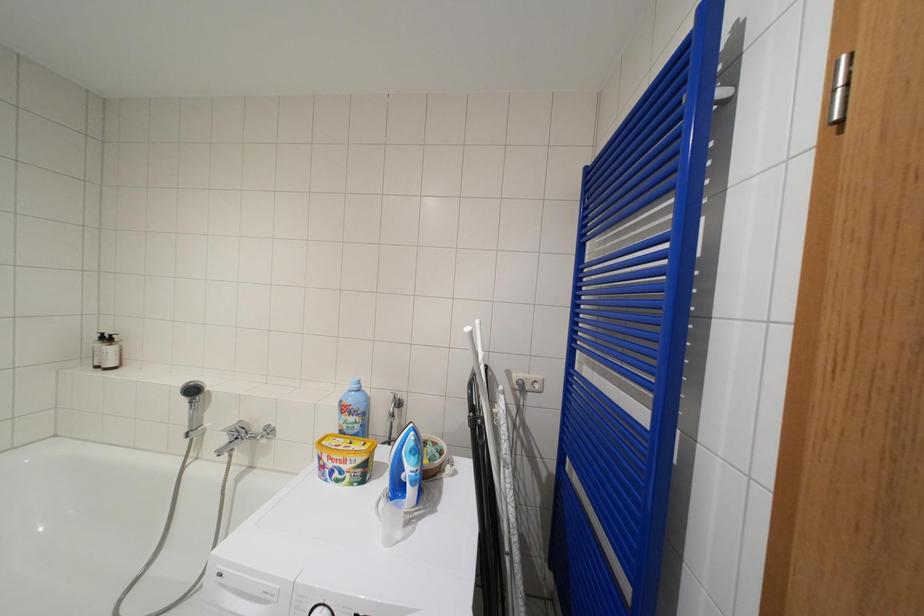
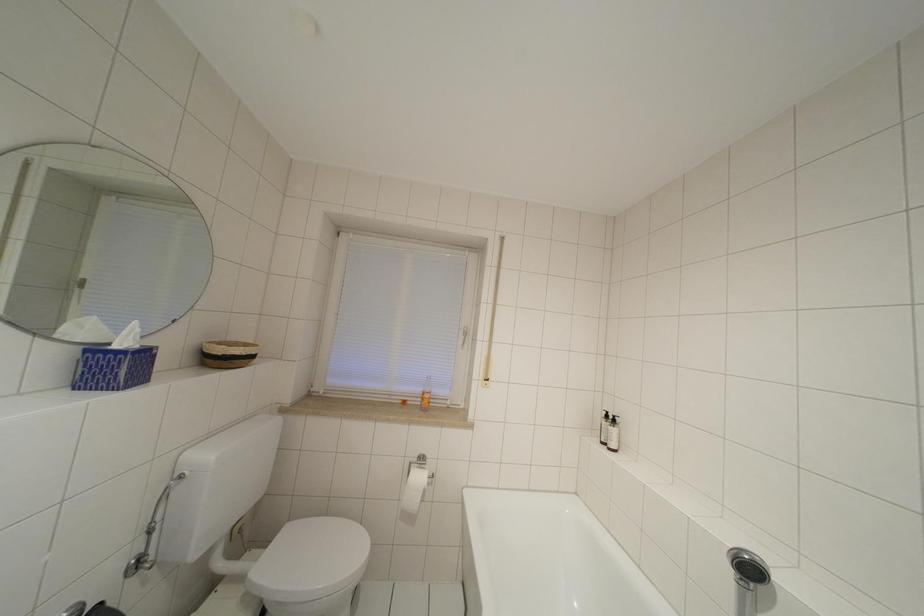
Question: The camera is either moving clockwise (left) or counter-clockwise (right) around the object. The first image is from the beginning of the video and the second image is from the end. Is the camera moving left or right when shooting the video?

Choices:
 (A) Left
 (B) Right

Answer: (B)